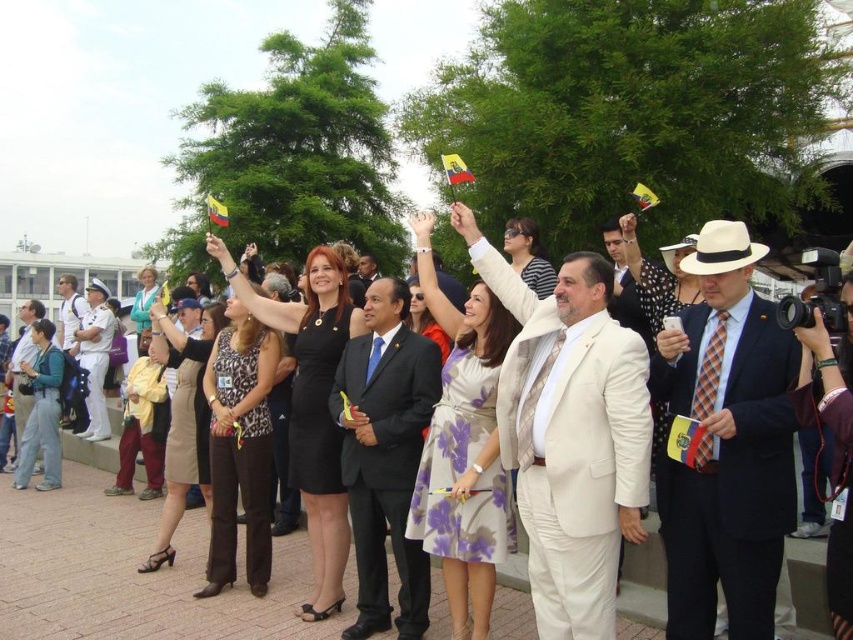
Between white satin suit at center and white uniform at left, which one appears on the right side from the viewer's perspective?

white satin suit at center is more to the right.

Does white satin suit at center appear over white uniform at left?

No.

Who is more distant from viewer, (610, 496) or (100, 336)?

Point (100, 336)

Where is `white satin suit at center`? The width and height of the screenshot is (853, 640). white satin suit at center is located at coordinates (570, 433).

Does matte black suit at center appear over matte black suit at left?

Incorrect, matte black suit at center is not positioned above matte black suit at left.

How distant is matte black suit at center from matte black suit at left?

matte black suit at center is 35.19 meters away from matte black suit at left.

What do you see at coordinates (386, 454) in the screenshot?
I see `matte black suit at center` at bounding box center [386, 454].

Identify the location of matte black suit at center. The height and width of the screenshot is (640, 853). (386, 454).

Which of these two, white satin suit at center or matte black suit at center, stands shorter?

matte black suit at center

Is white satin suit at center bigger than matte black suit at center?

Correct, white satin suit at center is larger in size than matte black suit at center.

Where is `white satin suit at center`? This screenshot has width=853, height=640. white satin suit at center is located at coordinates (570, 433).